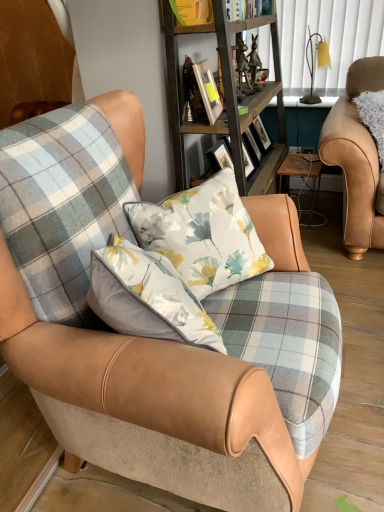
Question: Can you confirm if plaid fabric chair at center, marked as the second chair in a right-to-left arrangement, is thinner than metallic silver picture frame at upper center?

Choices:
 (A) yes
 (B) no

Answer: (B)

Question: Is plaid fabric chair at center, which is the first chair in left-to-right order, at the left side of metallic silver picture frame at upper center?

Choices:
 (A) no
 (B) yes

Answer: (B)

Question: Is plaid fabric chair at center, the 2th chair viewed from the back, looking in the opposite direction of metallic silver picture frame at upper center?

Choices:
 (A) yes
 (B) no

Answer: (B)

Question: Does plaid fabric chair at center, arranged as the 1th chair when viewed from the front, have a smaller size compared to metallic silver picture frame at upper center?

Choices:
 (A) yes
 (B) no

Answer: (B)

Question: Does plaid fabric chair at center, arranged as the 1th chair when viewed from the front, have a greater width compared to metallic silver picture frame at upper center?

Choices:
 (A) no
 (B) yes

Answer: (B)

Question: In terms of size, does metallic silver picture frame at upper center appear bigger or smaller than wooden table at center?

Choices:
 (A) big
 (B) small

Answer: (B)

Question: Considering their positions, is metallic silver picture frame at upper center located in front of or behind wooden table at center?

Choices:
 (A) front
 (B) behind

Answer: (A)

Question: Which is correct: metallic silver picture frame at upper center is inside wooden table at center, or outside of it?

Choices:
 (A) inside
 (B) outside

Answer: (B)

Question: In the image, is metallic silver picture frame at upper center on the left side or the right side of wooden table at center?

Choices:
 (A) left
 (B) right

Answer: (A)

Question: Considering the positions of leather armchair at right, arranged as the second chair when viewed from the left, and wooden table at center in the image, is leather armchair at right, arranged as the second chair when viewed from the left, taller or shorter than wooden table at center?

Choices:
 (A) tall
 (B) short

Answer: (A)

Question: Based on their sizes in the image, would you say leather armchair at right, which ranks as the first chair in right-to-left order, is bigger or smaller than wooden table at center?

Choices:
 (A) small
 (B) big

Answer: (B)

Question: Considering the positions of leather armchair at right, arranged as the second chair when viewed from the left, and wooden table at center in the image, is leather armchair at right, arranged as the second chair when viewed from the left, wider or thinner than wooden table at center?

Choices:
 (A) wide
 (B) thin

Answer: (A)

Question: Visually, is leather armchair at right, placed as the first chair when sorted from back to front, positioned to the left or to the right of wooden table at center?

Choices:
 (A) left
 (B) right

Answer: (B)

Question: In terms of width, does wooden table at center look wider or thinner when compared to leather armchair at right, which ranks as the first chair in right-to-left order?

Choices:
 (A) thin
 (B) wide

Answer: (A)

Question: From the image's perspective, is wooden table at center positioned above or below leather armchair at right, placed as the second chair when sorted from front to back?

Choices:
 (A) below
 (B) above

Answer: (A)